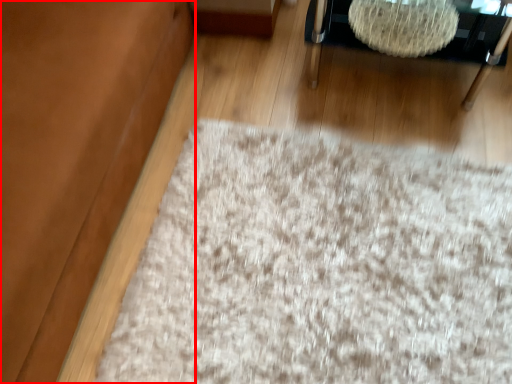
Question: Considering the relative positions of couch (annotated by the red box) and furniture in the image provided, where is couch (annotated by the red box) located with respect to the staircase?

Choices:
 (A) left
 (B) right

Answer: (A)